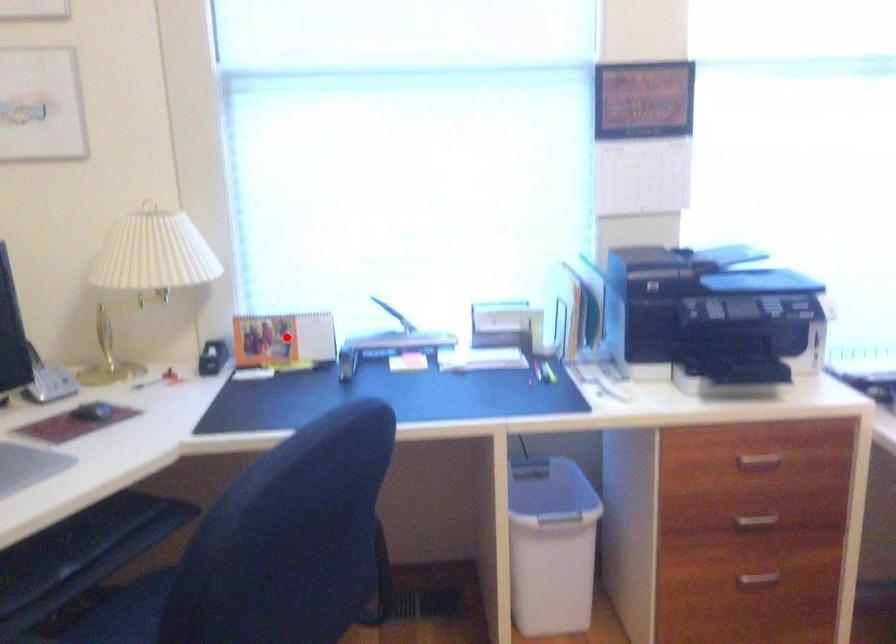
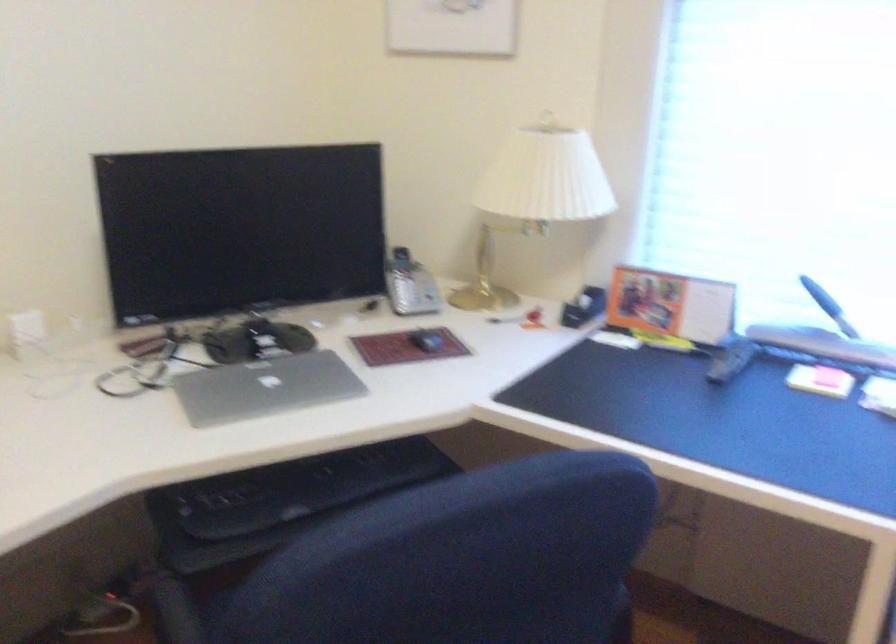
Question: I am providing you with two images of the same scene from different viewpoints. A red point is shown in image1. For the corresponding object point in image2, is it positioned nearer or farther from the camera?

Choices:
 (A) Nearer
 (B) Farther

Answer: (A)